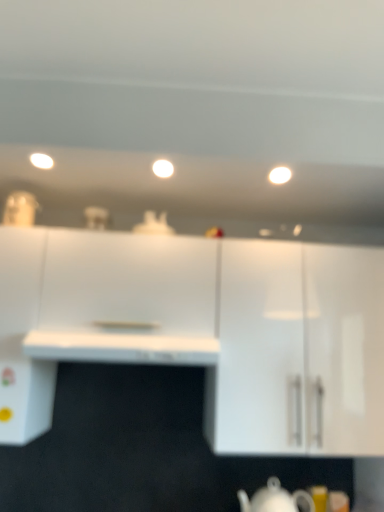
Identify the location of vacant area situated to the left side of white glossy light at upper center, which is counted as the 3th lighting, starting from the left. (x=231, y=167).